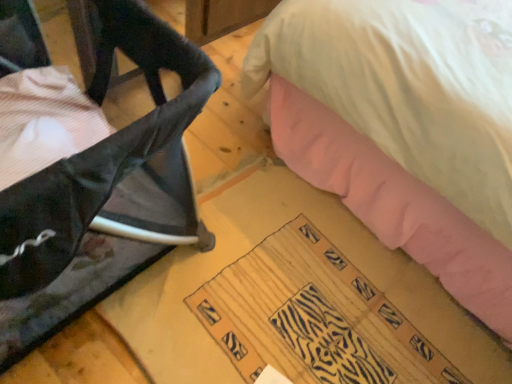
Question: Can you confirm if zebra-patterned fabric at lower center is thinner than black mesh chair at left?

Choices:
 (A) no
 (B) yes

Answer: (B)

Question: Is zebra-patterned fabric at lower center to the right of black mesh chair at left from the viewer's perspective?

Choices:
 (A) yes
 (B) no

Answer: (A)

Question: Does zebra-patterned fabric at lower center have a larger size compared to black mesh chair at left?

Choices:
 (A) yes
 (B) no

Answer: (B)

Question: From the image's perspective, is zebra-patterned fabric at lower center located beneath black mesh chair at left?

Choices:
 (A) no
 (B) yes

Answer: (B)

Question: Is the surface of zebra-patterned fabric at lower center in direct contact with black mesh chair at left?

Choices:
 (A) no
 (B) yes

Answer: (A)

Question: Considering the relative sizes of zebra-patterned fabric at lower center and black mesh chair at left in the image provided, is zebra-patterned fabric at lower center wider than black mesh chair at left?

Choices:
 (A) no
 (B) yes

Answer: (A)

Question: Is black mesh chair at left touching zebra-patterned fabric at lower center?

Choices:
 (A) yes
 (B) no

Answer: (B)

Question: Considering the relative positions of black mesh chair at left and zebra-patterned fabric at lower center in the image provided, is black mesh chair at left in front of zebra-patterned fabric at lower center?

Choices:
 (A) no
 (B) yes

Answer: (B)

Question: Does black mesh chair at left appear on the right side of zebra-patterned fabric at lower center?

Choices:
 (A) no
 (B) yes

Answer: (A)

Question: Considering the relative sizes of black mesh chair at left and zebra-patterned fabric at lower center in the image provided, is black mesh chair at left wider than zebra-patterned fabric at lower center?

Choices:
 (A) no
 (B) yes

Answer: (B)

Question: Is black mesh chair at left oriented away from zebra-patterned fabric at lower center?

Choices:
 (A) yes
 (B) no

Answer: (B)

Question: Is zebra-patterned fabric at lower center located within black mesh chair at left?

Choices:
 (A) yes
 (B) no

Answer: (B)

Question: Looking at their shapes, would you say black mesh chair at left is wider or thinner than zebra-patterned fabric at lower center?

Choices:
 (A) thin
 (B) wide

Answer: (B)